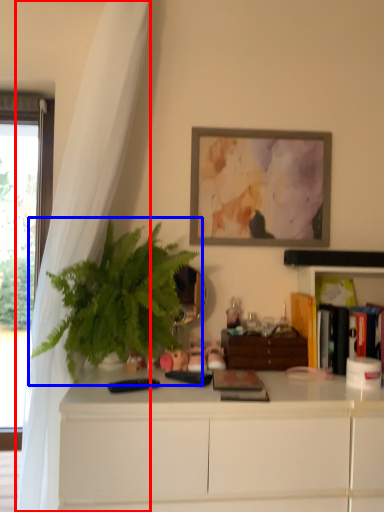
Question: Which object appears closest to the camera in this image, curtain (highlighted by a red box) or houseplant (highlighted by a blue box)?

Choices:
 (A) curtain
 (B) houseplant

Answer: (A)